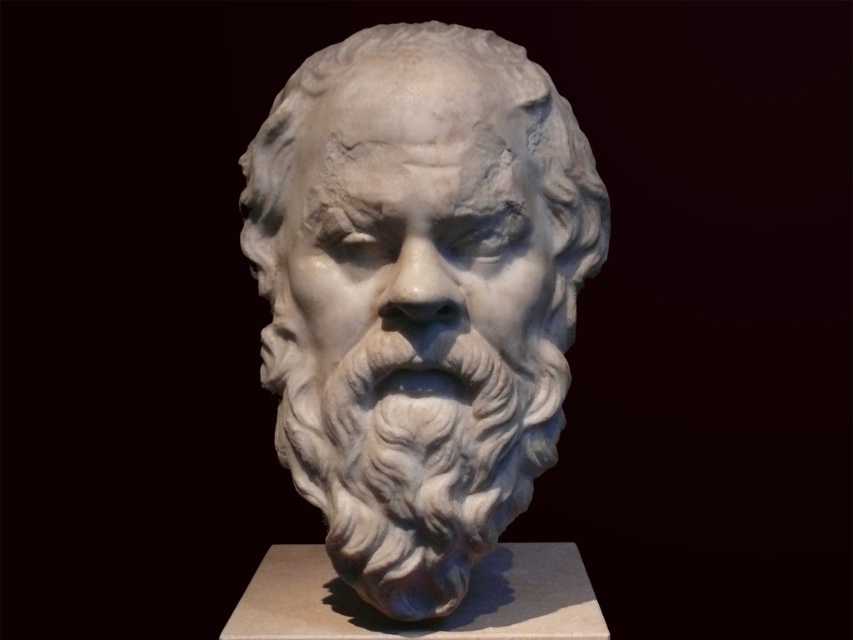
You are an art student analyzing the sculpture. You notice the white marble bust at center and the white marble face at center. Which part is closer to you?

The white marble bust at center is closer to you than the white marble face at center.